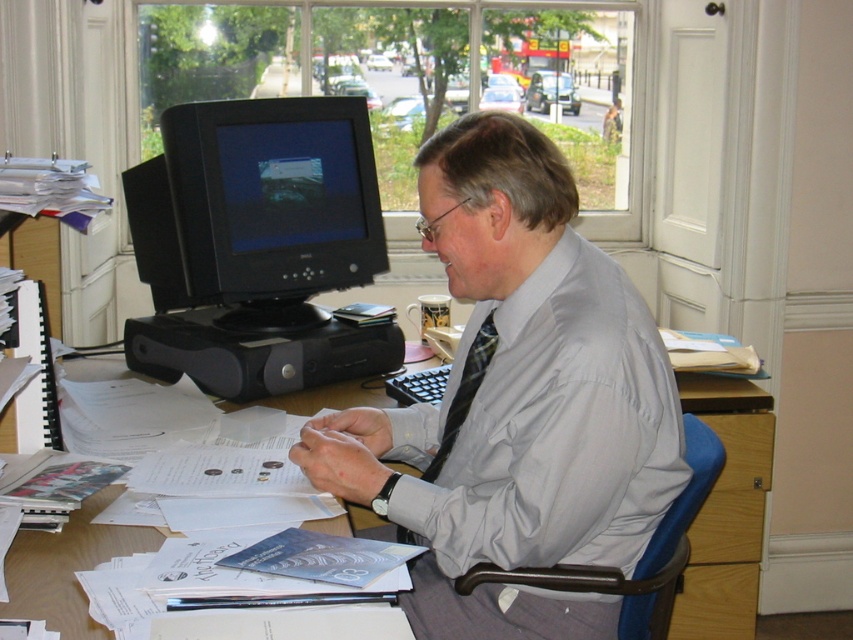
You are a tailor who needs to determine if the gray silk shirt at center can be folded and placed on the matte black monitor at left without exceeding its surface area. Based on the information provided, can the shirt fit on the monitor?

The gray silk shirt at center has a larger size compared to matte black monitor at left, so it cannot be folded to fit entirely on the matte black monitor at left without exceeding its surface area.

You are an office assistant who needs to place a new document on the wooden desk at center. However, you notice the gray silk shirt at center is currently occupying the space. Can you place the document there without moving the shirt?

The gray silk shirt at center is above the wooden desk at center, so it is likely hanging on a chair or hook near the desk. You can place the document on the wooden desk at center underneath the shirt without moving it.